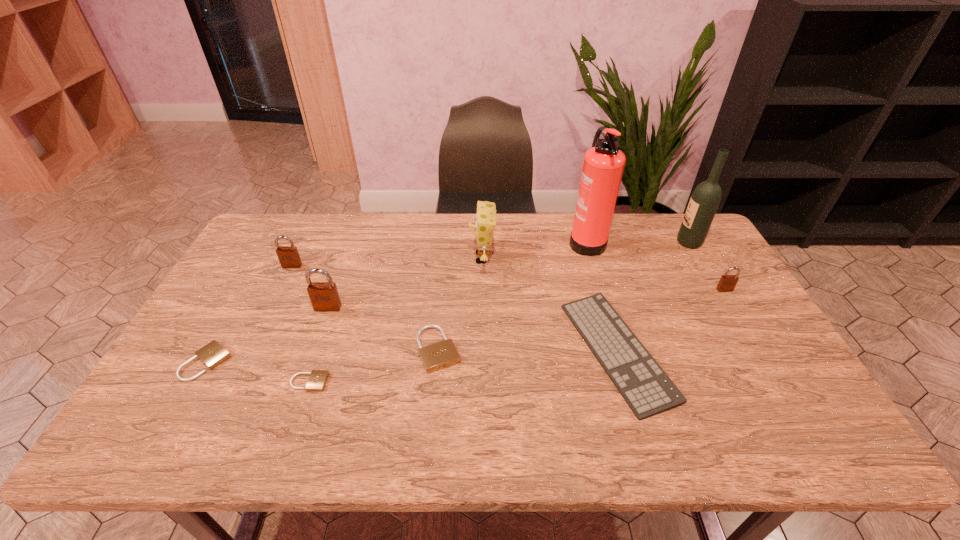
Where is `free spot located on the front-facing side of the second nearest brown padlock`? The width and height of the screenshot is (960, 540). free spot located on the front-facing side of the second nearest brown padlock is located at coordinates (761, 352).

Locate an element on the screen. free space located 0.370m on the left of the rightmost beige padlock is located at coordinates (276, 349).

Identify the location of vacant space located on the back of the computer keyboard. (595, 275).

At what (x,y) coordinates should I click in order to perform the action: click on vacant area located 0.340m on the back of the leftmost beige padlock. Please return your answer as a coordinate pair (x, y). The image size is (960, 540). Looking at the image, I should click on (263, 262).

Locate an element on the screen. The width and height of the screenshot is (960, 540). blank space located on the right of the second beige padlock from right to left is located at coordinates (379, 382).

The width and height of the screenshot is (960, 540). I want to click on fire extinguisher present at the far edge, so click(603, 166).

Find the location of `wine bottle that is at the far edge`. wine bottle that is at the far edge is located at coordinates (704, 202).

Where is `sponge that is at the far edge`? sponge that is at the far edge is located at coordinates click(x=485, y=218).

Where is `object present at the near edge`? object present at the near edge is located at coordinates (646, 388).

This screenshot has height=540, width=960. I want to click on wine bottle that is at the right edge, so click(x=704, y=202).